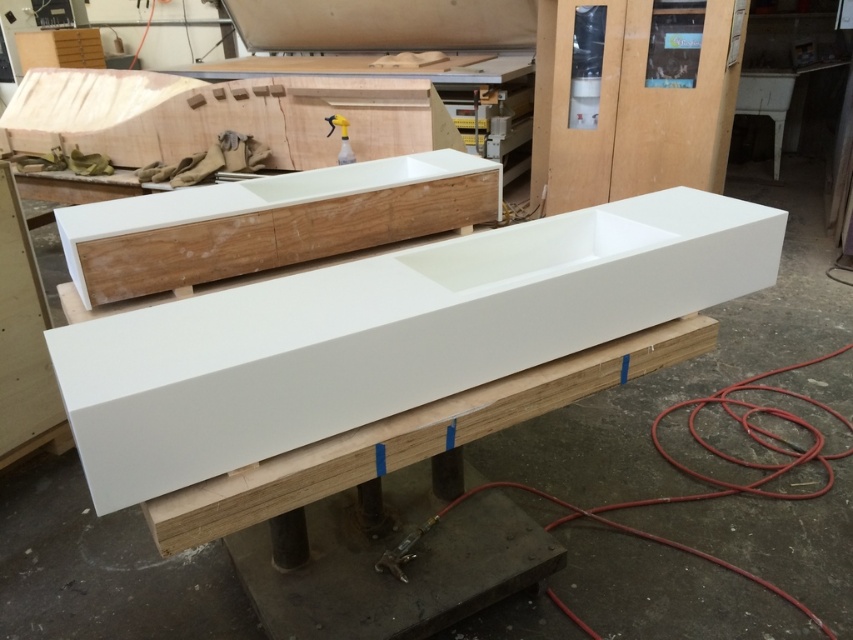
Who is more forward, [700,218] or [86,296]?

Positioned in front is point [86,296].

Between white glossy trough at center and matte white plywood at center, which one has less height?

matte white plywood at center is shorter.

Which is in front, point (381, 392) or point (241, 268)?

Point (381, 392) is in front.

At what (x,y) coordinates should I click in order to perform the action: click on white glossy trough at center. Please return your answer as a coordinate pair (x, y). The height and width of the screenshot is (640, 853). Looking at the image, I should click on (387, 333).